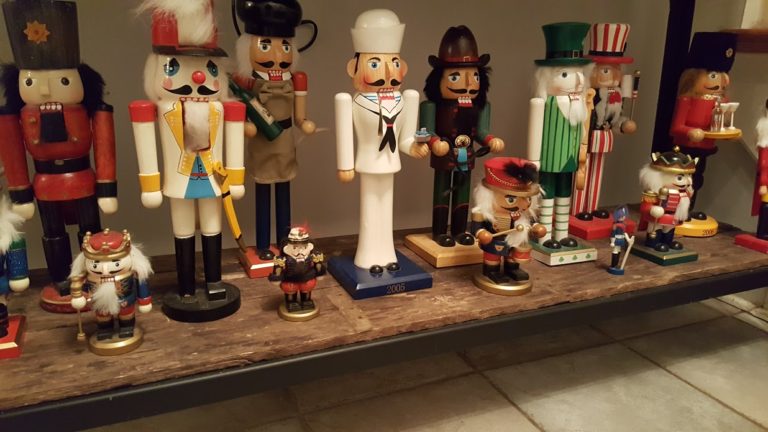
What are the coordinates of `frame of the cabinet` in the screenshot? It's located at (674, 39).